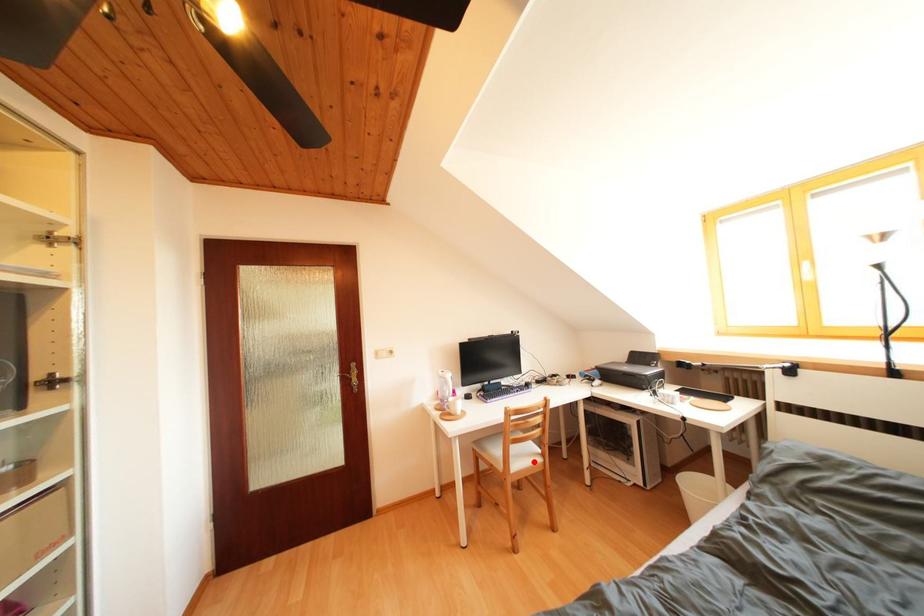
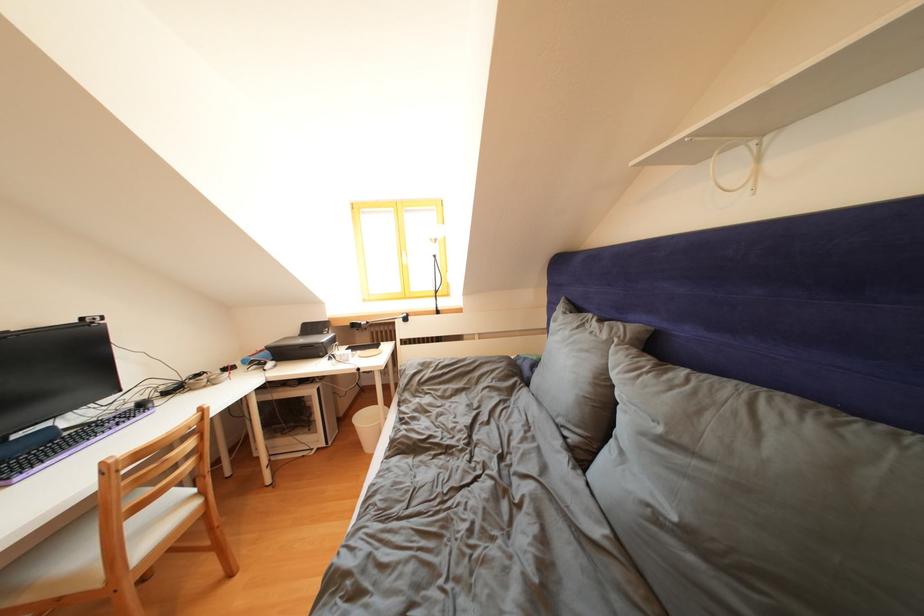
Question: I am providing you with two images of the same scene from different viewpoints. Given a red point in image1, look at the same physical point in image2. Is it:

Choices:
 (A) Closer to the viewpoint
 (B) Farther from the viewpoint

Answer: (A)